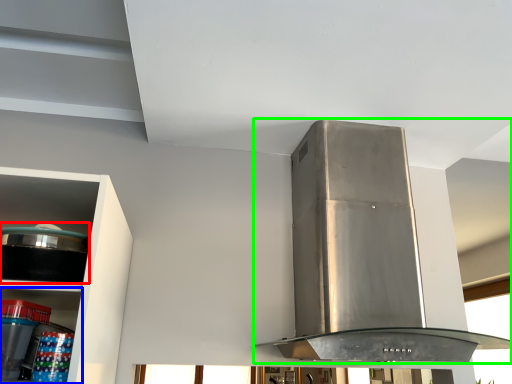
Question: Which object is the closest to the appliance (highlighted by a red box)? Choose among these: shelf (highlighted by a blue box) or home appliance (highlighted by a green box).

Choices:
 (A) shelf
 (B) home appliance

Answer: (A)